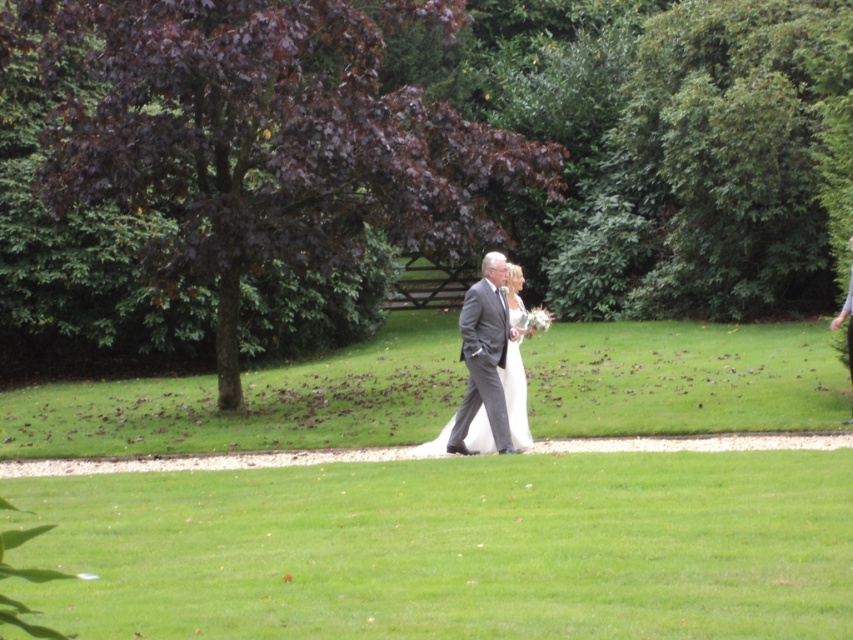
In the scene shown: You are a photographer planning to capture a photo of the gray suit at center and the green grass at center. Which object occupies more area in the image?

The green grass at center is bigger than the gray suit at center, so it occupies more area in the image.